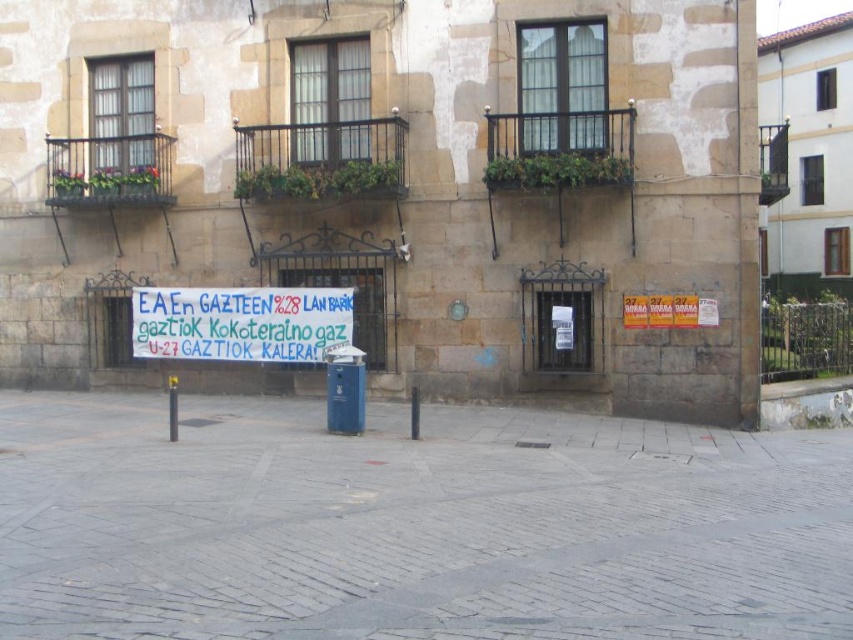
Question: Which point is farther from the camera taking this photo?

Choices:
 (A) (143, 340)
 (B) (625, 618)

Answer: (A)

Question: Among these points, which one is farthest from the camera?

Choices:
 (A) (177, 396)
 (B) (59, 454)
 (C) (218, 337)

Answer: (A)

Question: Does gray cobblestone pavement at center have a greater width compared to yellow plastic pole at center?

Choices:
 (A) yes
 (B) no

Answer: (A)

Question: Which object appears closest to the camera in this image?

Choices:
 (A) black plastic pole at center
 (B) gray cobblestone pavement at center
 (C) yellow plastic pole at center
 (D) white paper banner at center

Answer: (B)

Question: Does yellow plastic pole at center have a larger size compared to black plastic pole at center?

Choices:
 (A) yes
 (B) no

Answer: (A)

Question: Does gray cobblestone pavement at center come behind yellow plastic pole at center?

Choices:
 (A) yes
 (B) no

Answer: (B)